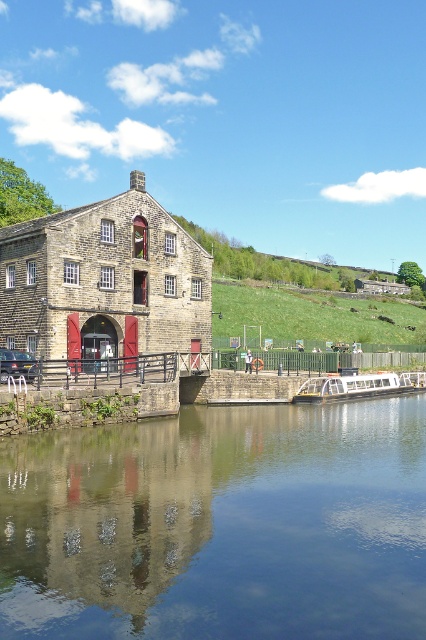
Question: Which of the following is the farthest from the observer?

Choices:
 (A) white glossy boat at lower center
 (B) transparent glass water at center

Answer: (A)

Question: Can you confirm if transparent glass water at center is positioned above white glossy boat at lower center?

Choices:
 (A) yes
 (B) no

Answer: (B)

Question: Which point appears farthest from the camera in this image?

Choices:
 (A) (199, 577)
 (B) (394, 388)

Answer: (B)

Question: Does transparent glass water at center have a larger size compared to white glossy boat at lower center?

Choices:
 (A) no
 (B) yes

Answer: (B)

Question: Does transparent glass water at center appear over white glossy boat at lower center?

Choices:
 (A) no
 (B) yes

Answer: (A)